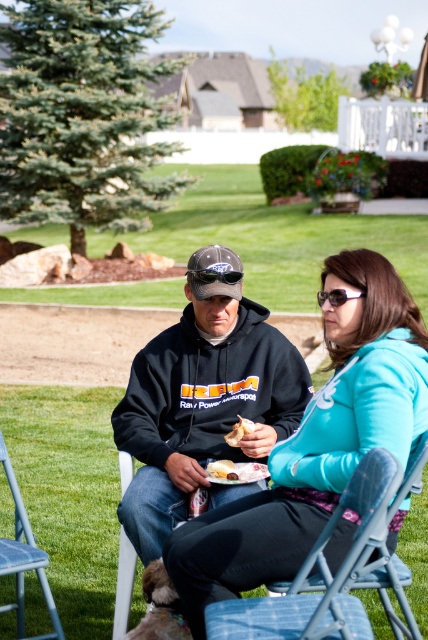
You are a photographer trying to capture both the green grass at center and the golden crispy chicken at center in a single shot. Which object should you focus on first to ensure both are in frame?

The green grass at center is further to the viewer than the golden crispy chicken at center, so you should focus on the golden crispy chicken at center first to ensure both are in frame.

Based on the coordinates provided, which object is located at point (272, 236)?

The green grass at center is located at point (272, 236).